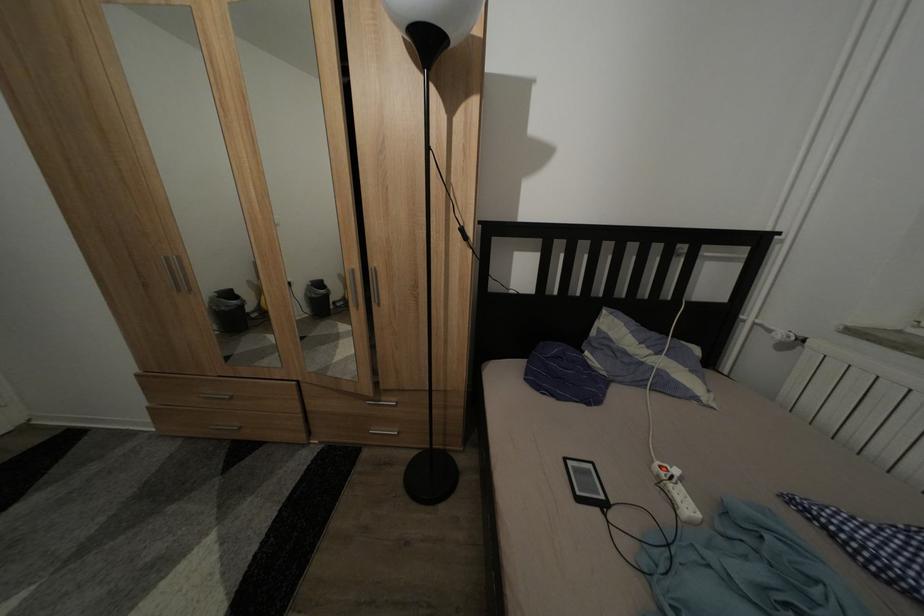
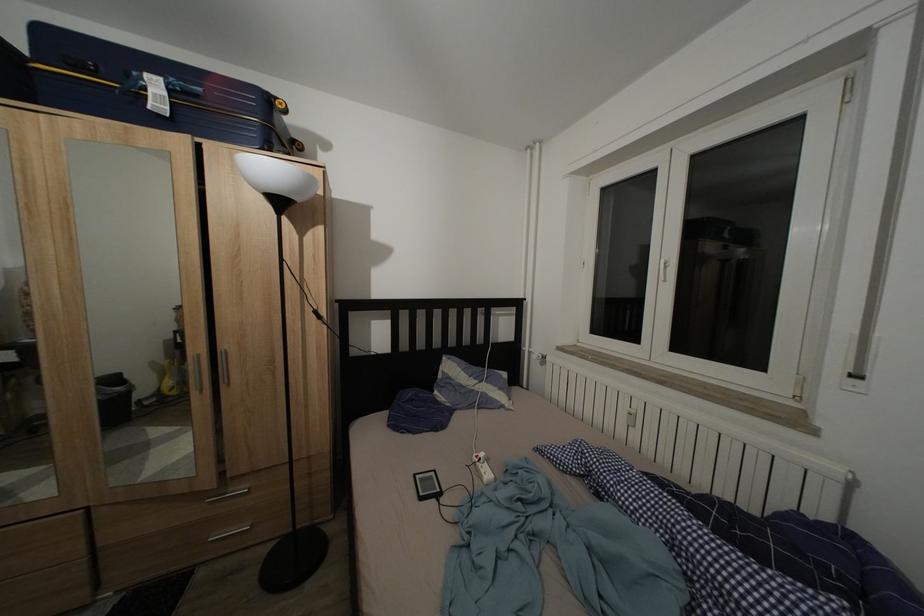
The point at (573, 466) is marked in the first image. Where is the corresponding point in the second image?

(422, 482)